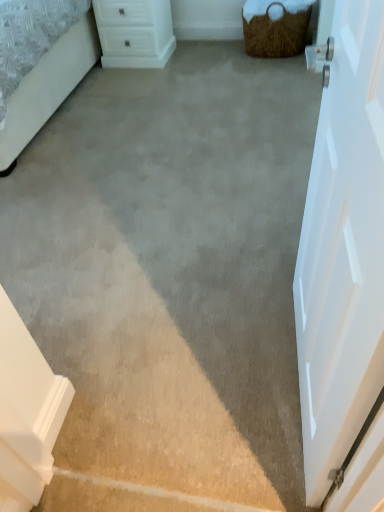
Locate an element on the screen. The image size is (384, 512). vacant area on the back side of white smooth door at right is located at coordinates (234, 278).